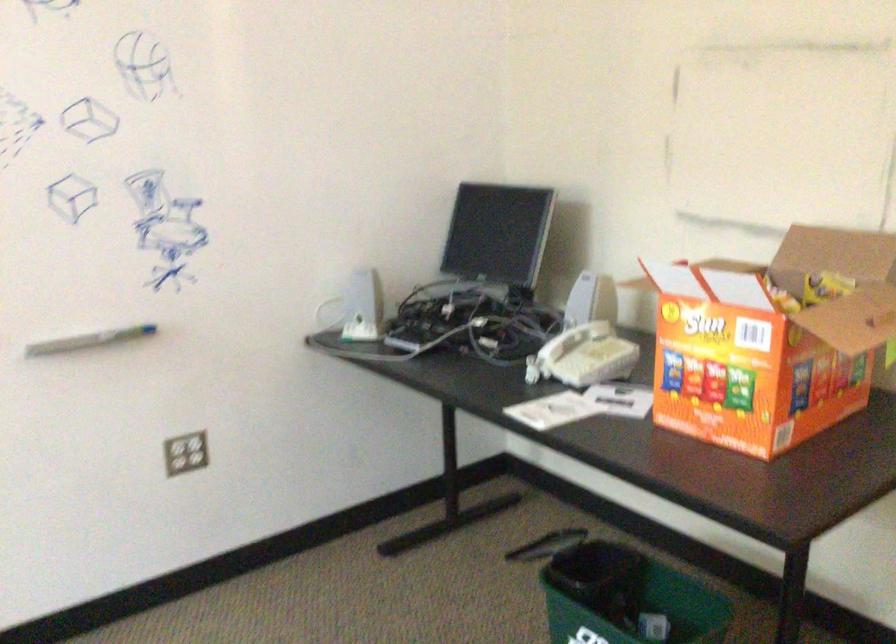
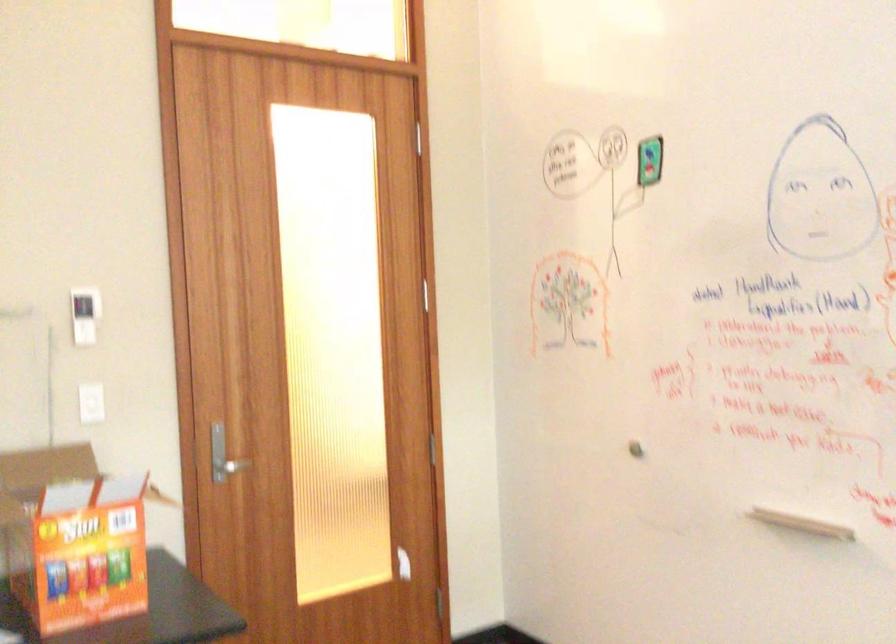
Question: I am providing you with two images of the same scene from different viewpoints. After the viewpoint changes to image2, which objects are now occluded?

Choices:
 (A) shower control handle
 (B) metal door handle
 (C) chip bag
 (D) orange cardboard box

Answer: (C)